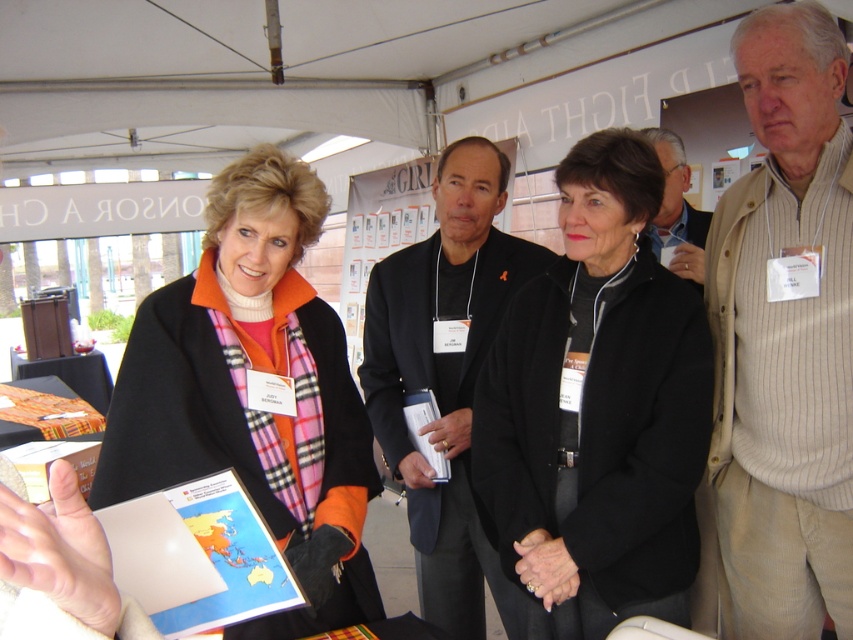
You are a photographer positioned to take a photo of the beige striped shirt at center and the gray striped sweater at upper right. Which of the two should you focus on first to ensure they are both in the frame?

The beige striped shirt at center is taller than the gray striped sweater at upper right, so you should focus on the beige striped shirt at center first to ensure both are in the frame.